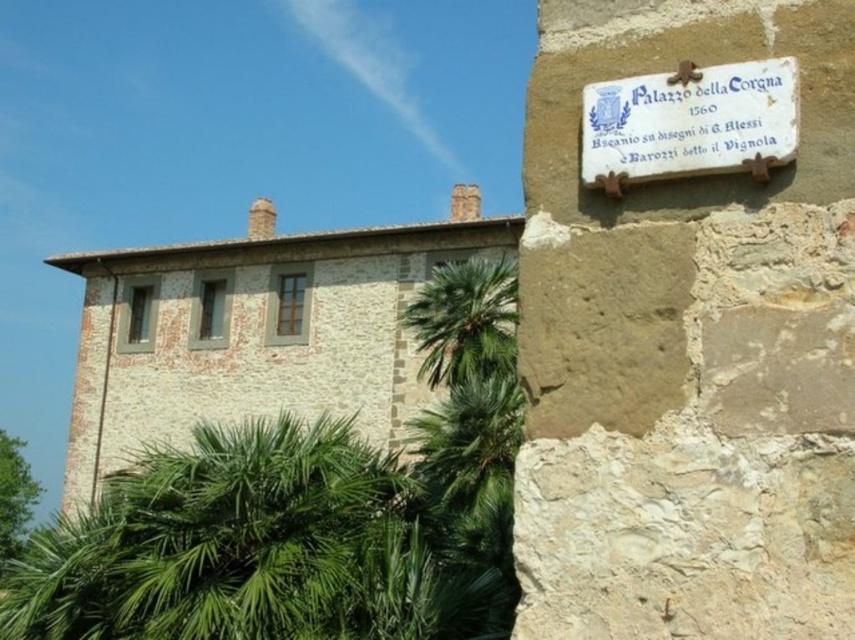
Question: Which point is farther to the camera?

Choices:
 (A) green leafy palm at center
 (B) white stone plaque at upper right

Answer: (A)

Question: Does white stone plaque at upper right have a greater width compared to green leafy palm at center?

Choices:
 (A) no
 (B) yes

Answer: (A)

Question: Which point appears closest to the camera in this image?

Choices:
 (A) (441, 308)
 (B) (593, 177)

Answer: (B)

Question: Which point is farther to the camera?

Choices:
 (A) green leafy palm at center
 (B) white stone plaque at upper right

Answer: (A)

Question: Where is white stone plaque at upper right located in relation to green leafy palm at center in the image?

Choices:
 (A) left
 (B) right

Answer: (B)

Question: Can you confirm if white stone plaque at upper right is positioned below green leafy palm at center?

Choices:
 (A) no
 (B) yes

Answer: (A)